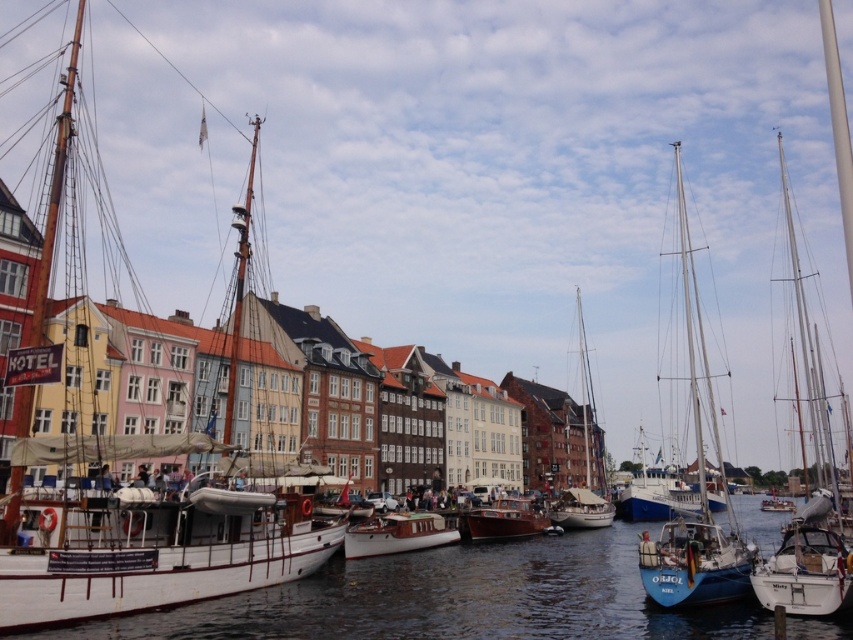
Question: Based on their relative distances, which object is nearer to the white matte sailboat at right?

Choices:
 (A) wooden sailboat at center
 (B) white matte sailboat at center

Answer: (A)

Question: Is white matte sailboat at center thinner than white matte boat at center?

Choices:
 (A) yes
 (B) no

Answer: (B)

Question: Can you confirm if white glossy boat at lower right is thinner than white polished wood boat at center?

Choices:
 (A) yes
 (B) no

Answer: (A)

Question: Which of the following is the farthest from the observer?

Choices:
 (A) white glossy boat at lower right
 (B) white wooden sailboat at left
 (C) white polished wood boat at center
 (D) wooden polished boat at center

Answer: (D)

Question: From the image, what is the correct spatial relationship of clear water at center in relation to white glossy boat at lower right?

Choices:
 (A) above
 (B) below

Answer: (B)

Question: Which point is farther from the camera taking this photo?

Choices:
 (A) (511, 529)
 (B) (592, 429)
 (C) (766, 604)
 (D) (815, 369)

Answer: (B)